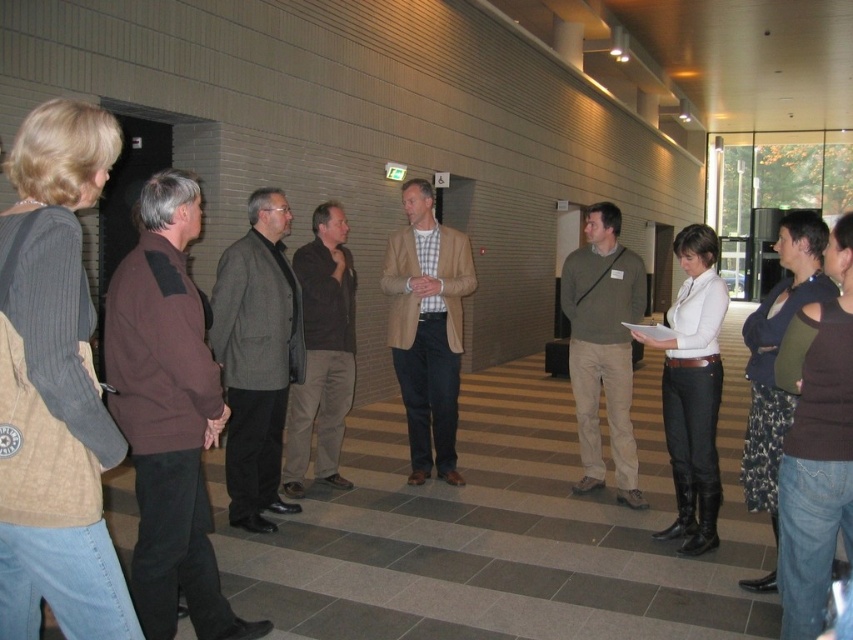
Question: Can you confirm if rustic brown sweater at left is positioned to the left of denim jeans at center?

Choices:
 (A) no
 (B) yes

Answer: (B)

Question: Based on their relative distances, which object is nearer to the matte green sweater at center?

Choices:
 (A) white matte shirt at center
 (B) tan textured blazer at center
 (C) denim jeans at center
 (D) gray wool blazer at center

Answer: (A)

Question: Which of the following is the closest to the observer?

Choices:
 (A) (128, 376)
 (B) (628, 380)

Answer: (A)

Question: Which object appears farthest from the camera in this image?

Choices:
 (A) gray wool blazer at center
 (B) brown fabric jacket at left

Answer: (A)

Question: Can you confirm if rustic brown sweater at left is wider than white matte shirt at center?

Choices:
 (A) no
 (B) yes

Answer: (A)

Question: Is the position of white matte shirt at center more distant than that of dark brown leather jacket at center?

Choices:
 (A) no
 (B) yes

Answer: (A)